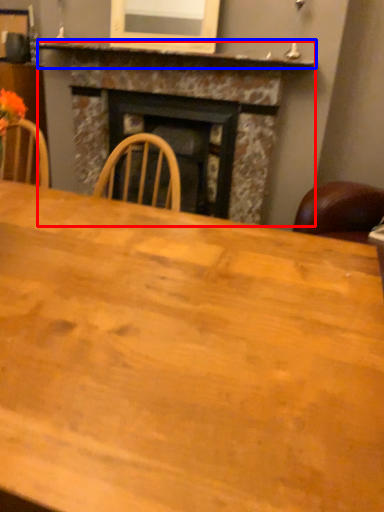
Question: Among these objects, which one is nearest to the camera, fireplace (highlighted by a red box) or mantle (highlighted by a blue box)?

Choices:
 (A) fireplace
 (B) mantle

Answer: (B)